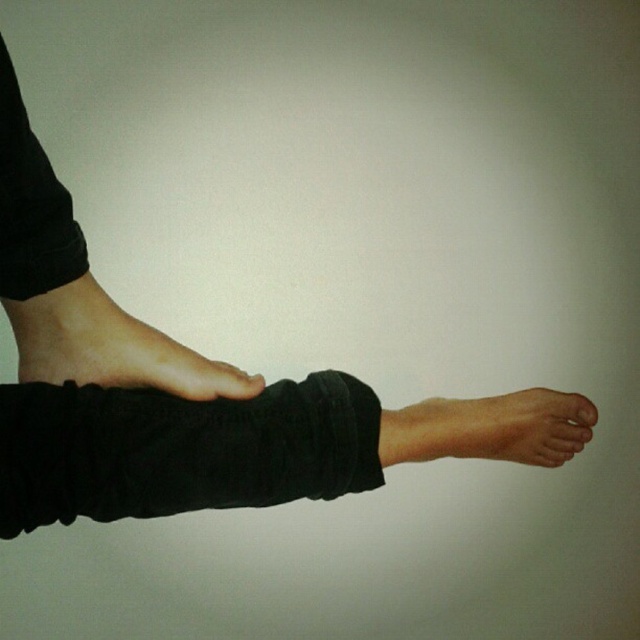
Question: Which point is farther to the camera?

Choices:
 (A) black matte leg at left
 (B) smooth skin foot at lower left

Answer: (B)

Question: Which point is farther to the camera?

Choices:
 (A) black matte leg at left
 (B) smooth skin foot at lower left
 (C) black cotton leg at center
 (D) skinny flesh at lower right

Answer: (D)

Question: Can you confirm if smooth skin foot at lower left is positioned below skinny flesh at lower right?

Choices:
 (A) no
 (B) yes

Answer: (A)

Question: Does black cotton leg at center lie in front of smooth skin foot at lower left?

Choices:
 (A) no
 (B) yes

Answer: (B)

Question: Which object is positioned closest to the skinny flesh at lower right?

Choices:
 (A) black cotton leg at center
 (B) smooth skin foot at lower left
 (C) black matte leg at left

Answer: (A)

Question: Does black cotton leg at center appear over skinny flesh at lower right?

Choices:
 (A) yes
 (B) no

Answer: (A)